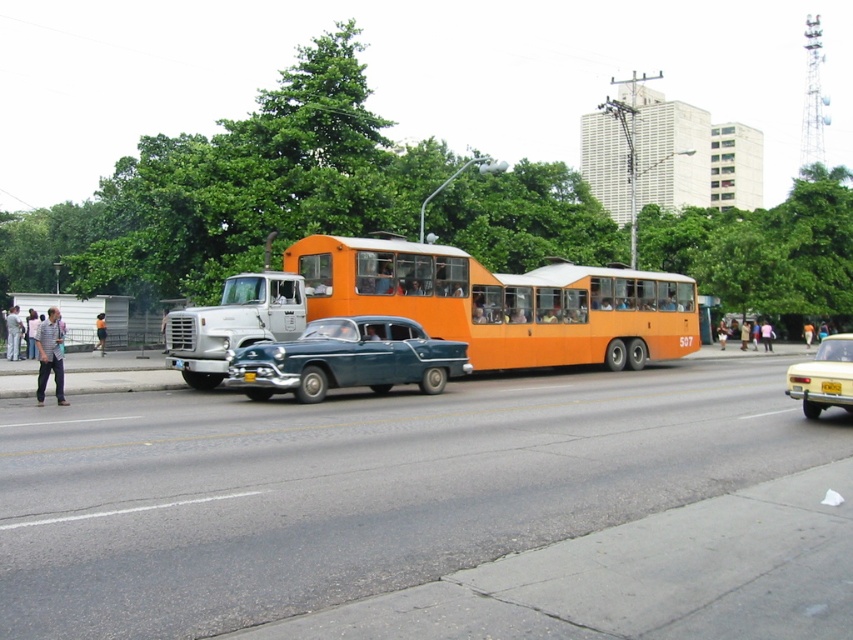
Question: Which point is farther to the camera?

Choices:
 (A) (97, 324)
 (B) (640, 342)
 (C) (383, 358)

Answer: (A)

Question: Which point is farther from the camera taking this photo?

Choices:
 (A) (305, 392)
 (B) (38, 336)
 (C) (10, 353)
 (D) (836, 353)

Answer: (C)

Question: Does light blue jeans at left have a larger size compared to orange fabric shirt at center?

Choices:
 (A) no
 (B) yes

Answer: (B)

Question: Which object is farther from the camera taking this photo?

Choices:
 (A) yellow metallic license plate at center
 (B) orange matte bus at center
 (C) light blue jeans at left

Answer: (C)

Question: Does shiny blue sedan at center appear on the left side of light blue jeans at left?

Choices:
 (A) yes
 (B) no

Answer: (B)

Question: Can you confirm if shiny blue sedan at center is thinner than yellow metallic license plate at center?

Choices:
 (A) yes
 (B) no

Answer: (B)